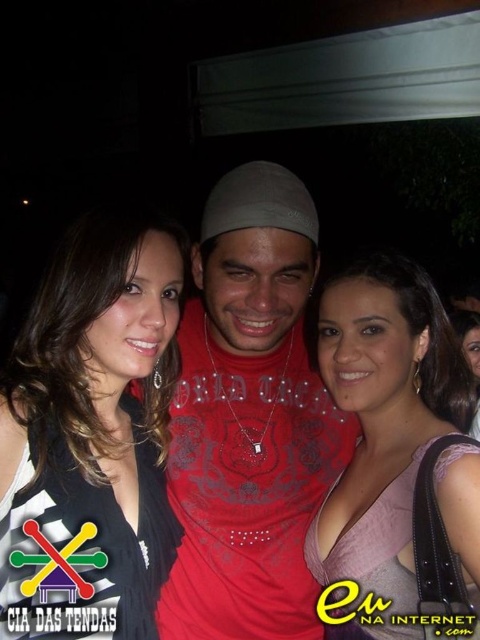
You are a photographer at a party and need to capture a group photo of the pink satin dress at center and the matte pink dress at center. The camera has a maximum focus range of 36 inches. Will both dresses be in focus?

The pink satin dress at center is 36.36 inches from matte pink dress at center. Since the distance between them exceeds the camera focus range of 36 inches, the camera cannot focus on both dresses simultaneously.